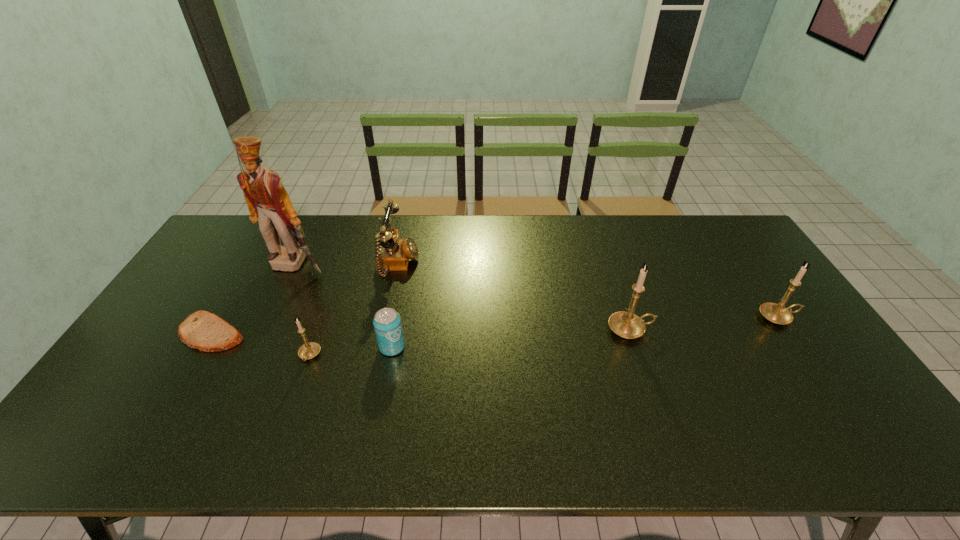
Where is `vacant area at the near edge of the desktop`? vacant area at the near edge of the desktop is located at coordinates (586, 391).

Locate an element on the screen. This screenshot has width=960, height=540. free space at the left edge is located at coordinates (207, 310).

In the image, there is a desktop. Where is `vacant space at the far left corner`? This screenshot has height=540, width=960. vacant space at the far left corner is located at coordinates (255, 238).

Locate an element on the screen. free space at the far right corner is located at coordinates (698, 231).

Find the location of a particular element. vacant space that's between the telephone and the pita bread is located at coordinates (304, 299).

Identify the location of vacant area between the shortest object and the second shortest candle holder. This screenshot has height=540, width=960. (494, 325).

You are a GUI agent. You are given a task and a screenshot of the screen. Output one action in this format:
    pyautogui.click(x=<x>, y=<y>)
    Task: Click on the empty space between the beer can and the shortest object
    
    Given the screenshot: What is the action you would take?
    pyautogui.click(x=301, y=340)

This screenshot has height=540, width=960. I want to click on vacant space in between the beer can and the shortest object, so click(301, 340).

Locate an element on the screen. The width and height of the screenshot is (960, 540). vacant point located between the third object from left to right and the second tallest candle holder is located at coordinates (543, 336).

Locate an element on the screen. This screenshot has width=960, height=540. free space between the nutcracker and the shortest object is located at coordinates click(254, 299).